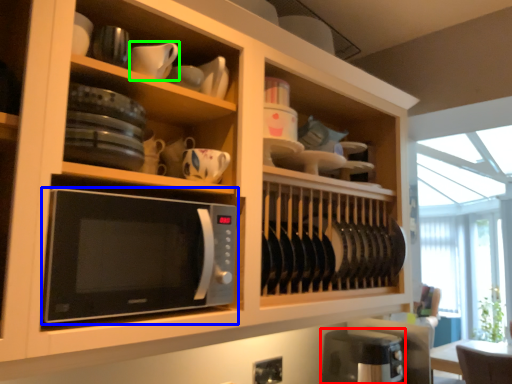
Question: Which object is the closest to the appliance (highlighted by a red box)? Choose among these: microwave oven (highlighted by a blue box) or tableware (highlighted by a green box).

Choices:
 (A) microwave oven
 (B) tableware

Answer: (A)